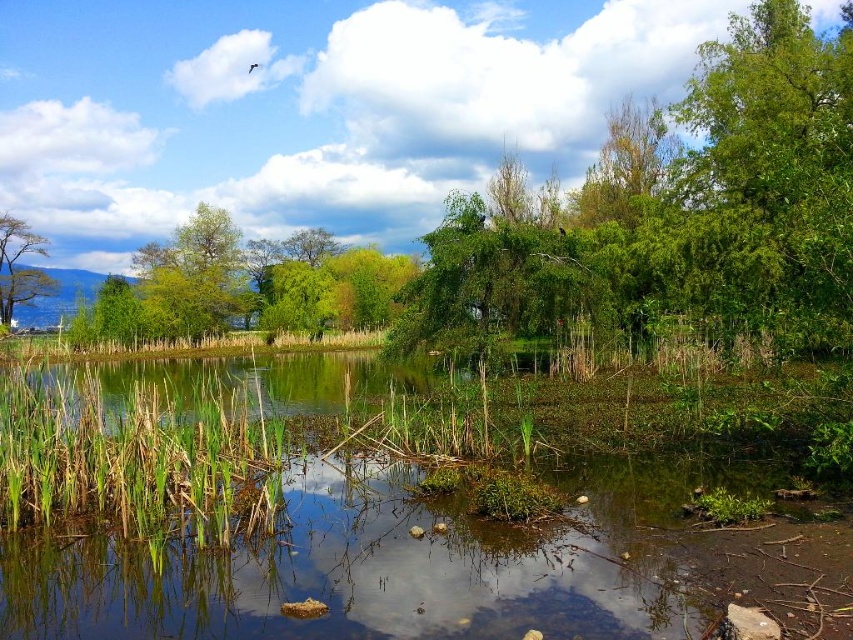
You are a bird flying over the serene natural landscape. You want to land on the green grassy reed at lower left and then move to the smooth bark tree at upper left. Which direction should you fly first?

The green grassy reed at lower left is positioned under the smooth bark tree at upper left, so you should fly upward to reach the smooth bark tree at upper left from the green grassy reed at lower left.

You are standing at the center of the image and want to walk towards the point marked as point [135,460]. Which direction should you go to reach it?

The point [135,460] is on green grassy reed at lower left, so you should go to the lower left direction to reach it.

You are a photographer trying to capture the reflection of the green grassy reed at lower left and the smooth bark tree at upper left in the water. Which object will have a smaller reflection in the water?

The green grassy reed at lower left will have a smaller reflection in the water because it occupies less space than the smooth bark tree at upper left.